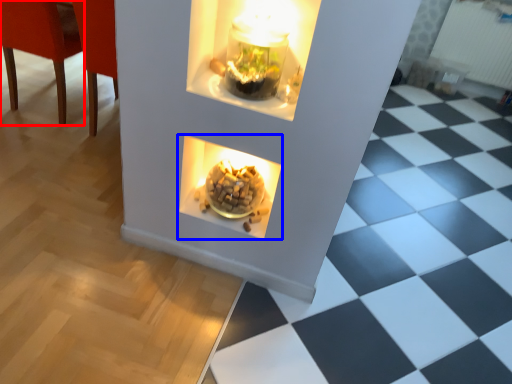
Question: Which object is closer to the camera taking this photo, chair (highlighted by a red box) or fireplace (highlighted by a blue box)?

Choices:
 (A) chair
 (B) fireplace

Answer: (B)